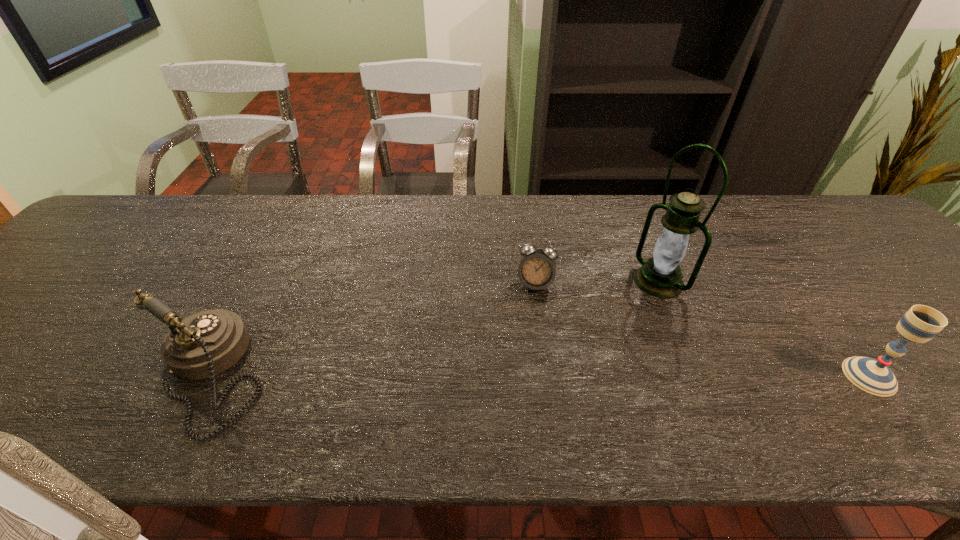
Find the location of `the leftmost object`. the leftmost object is located at coordinates click(x=205, y=344).

What are the coordinates of `the rightmost object` in the screenshot? It's located at (920, 323).

Find the location of a particular element. The height and width of the screenshot is (540, 960). lantern is located at coordinates (660, 276).

Locate an element on the screen. the tallest object is located at coordinates (660, 276).

Locate an element on the screen. This screenshot has height=540, width=960. the third object from right to left is located at coordinates (537, 269).

Identify the location of the shortest object. The image size is (960, 540). (537, 269).

This screenshot has height=540, width=960. In order to click on vacant space located on the right of the leftmost object in this screenshot , I will do `click(400, 375)`.

Where is `free spot located on the back of the chalice`? free spot located on the back of the chalice is located at coordinates (782, 262).

Find the location of a particular element. free spot located 0.280m on the side where the second object from right to left emits light is located at coordinates (561, 346).

Find the location of a particular element. The height and width of the screenshot is (540, 960). free space located on the side where the second object from right to left emits light is located at coordinates (561, 346).